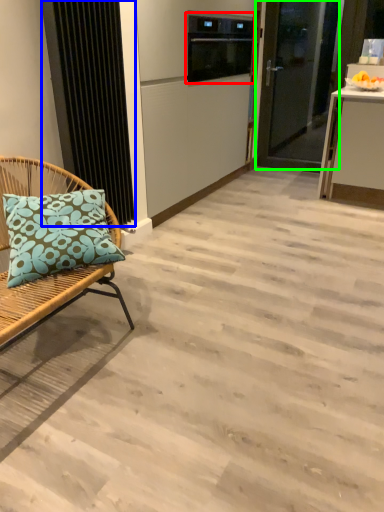
Question: Which is farther away from appliance (highlighted by a red box)? radiator (highlighted by a blue box) or door (highlighted by a green box)?

Choices:
 (A) radiator
 (B) door

Answer: (A)